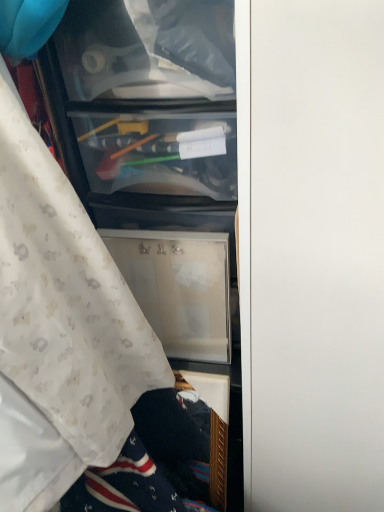
What is the approximate width of white matte door at center?

It is 55.26 centimeters.

Measure the distance between point (317, 442) and camera.

Point (317, 442) and camera are 35.39 inches apart.

Image resolution: width=384 pixels, height=512 pixels. In order to click on white matte door at center in this screenshot , I will do `click(317, 255)`.

Describe the element at coordinates (317, 255) in the screenshot. This screenshot has height=512, width=384. I see `white matte door at center` at that location.

In order to face white textured fabric at left, should I rotate leftwards or rightwards?

Rotate your view left by about 20.162°.

This screenshot has width=384, height=512. In order to click on white textured fabric at left in this screenshot , I will do `click(60, 327)`.

Describe the element at coordinates (60, 327) in the screenshot. I see `white textured fabric at left` at that location.

You are a GUI agent. You are given a task and a screenshot of the screen. Output one action in this format:
    pyautogui.click(x=<x>, y=<y>)
    Task: Click on the white matte door at center
    The image size is (384, 512).
    Given the screenshot: What is the action you would take?
    pyautogui.click(x=317, y=255)

In the scene shown: Visually, is white matte door at center positioned to the left or to the right of white textured fabric at left?

white matte door at center is positioned on white textured fabric at left's right side.

Considering the relative positions of white matte door at center and white textured fabric at left in the image provided, is white matte door at center in front of white textured fabric at left?

No, the depth of white matte door at center is greater than that of white textured fabric at left.

Is point (288, 360) behind point (32, 294)?

Yes, it is behind point (32, 294).

From the picture: From the image's perspective, which object appears higher, white matte door at center or white textured fabric at left?

white textured fabric at left appears higher in the image.

From a real-world perspective, is white matte door at center positioned above or below white textured fabric at left?

white matte door at center is below white textured fabric at left.

Can you confirm if white matte door at center is thinner than white textured fabric at left?

No.

Consider the image. Is white matte door at center taller than white textured fabric at left?

Correct, white matte door at center is much taller as white textured fabric at left.

Is white matte door at center bigger than white textured fabric at left?

Indeed, white matte door at center has a larger size compared to white textured fabric at left.

Is white textured fabric at left located within white matte door at center?

No, white matte door at center does not contain white textured fabric at left.

Is the surface of white matte door at center in direct contact with white textured fabric at left?

There is a gap between white matte door at center and white textured fabric at left.

Is white matte door at center facing towards white textured fabric at left?

No, white matte door at center is not aimed at white textured fabric at left.

Measure the distance between white matte door at center and white textured fabric at left.

12.99 inches.

Image resolution: width=384 pixels, height=512 pixels. What are the coordinates of `door behind the white textured fabric at left` in the screenshot? It's located at click(317, 255).

Is white textured fabric at left at the left side of white matte door at center?

Correct, you'll find white textured fabric at left to the left of white matte door at center.

Is the depth of white textured fabric at left greater than that of white matte door at center?

That is False.

Is point (42, 419) closer or farther from the camera than point (326, 140)?

Point (42, 419).

From the image's perspective, which is above, white textured fabric at left or white matte door at center?

white textured fabric at left appears higher in the image.

From a real-world perspective, which object stands above the other?

white textured fabric at left.

Considering the sizes of objects white textured fabric at left and white matte door at center in the image provided, who is thinner, white textured fabric at left or white matte door at center?

Thinner between the two is white textured fabric at left.

Does white textured fabric at left have a lesser height compared to white matte door at center?

Yes.

Is white textured fabric at left bigger than white matte door at center?

No.

Is white textured fabric at left situated inside white matte door at center or outside?

white textured fabric at left is spatially situated outside white matte door at center.

Is white textured fabric at left with white matte door at center?

There is a gap between white textured fabric at left and white matte door at center.

Could you tell me if white textured fabric at left is facing white matte door at center?

No.

How many degrees apart are the facing directions of white textured fabric at left and white matte door at center?

They differ by 90.7 degrees in their facing directions.

How much distance is there between white textured fabric at left and white matte door at center?

A distance of 12.99 inches exists between white textured fabric at left and white matte door at center.

The height and width of the screenshot is (512, 384). Identify the location of curtain that appears on the left of white matte door at center. (60, 327).

Locate an element on the screen. curtain on the left of white matte door at center is located at coordinates (60, 327).

At what (x,y) coordinates should I click in order to perform the action: click on curtain above the white matte door at center (from a real-world perspective). Please return your answer as a coordinate pair (x, y). Looking at the image, I should click on (60, 327).